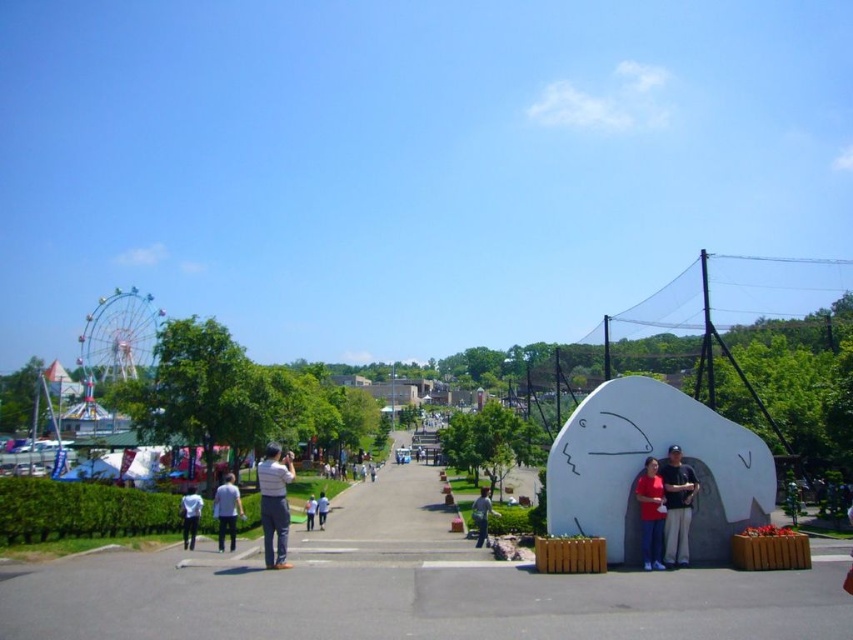
Which of these two, light blue shirt at center or light blue denim jeans at center, stands shorter?

Standing shorter between the two is light blue shirt at center.

Is point (238, 493) farther from viewer compared to point (480, 506)?

No, (238, 493) is in front of (480, 506).

What are the coordinates of `light blue shirt at center` in the screenshot? It's located at (227, 509).

Does light gray fabric jacket at center have a smaller size compared to white matte shirt at lower left?

Actually, light gray fabric jacket at center might be larger than white matte shirt at lower left.

Does point (264, 461) lie in front of point (193, 508)?

Yes, point (264, 461) is closer to viewer.

The image size is (853, 640). Describe the element at coordinates (274, 502) in the screenshot. I see `light gray fabric jacket at center` at that location.

Where is `light gray fabric jacket at center`? The height and width of the screenshot is (640, 853). light gray fabric jacket at center is located at coordinates (274, 502).

Is light blue shirt at center further to the viewer compared to white cotton shirt at center?

No.

Does point (218, 522) come in front of point (310, 513)?

Yes.

Image resolution: width=853 pixels, height=640 pixels. Identify the location of light blue shirt at center. [x=227, y=509].